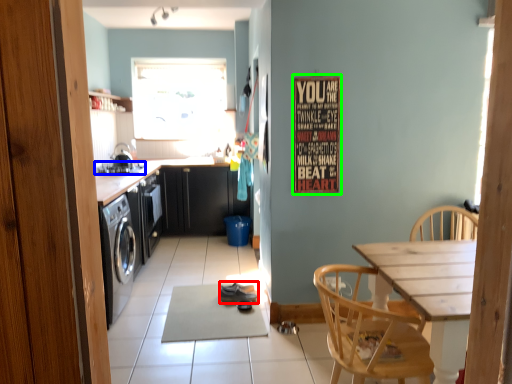
Question: Which object is the closest to the shoe (highlighted by a red box)? Choose among these: stove (highlighted by a blue box) or bulletin board (highlighted by a green box).

Choices:
 (A) stove
 (B) bulletin board

Answer: (B)